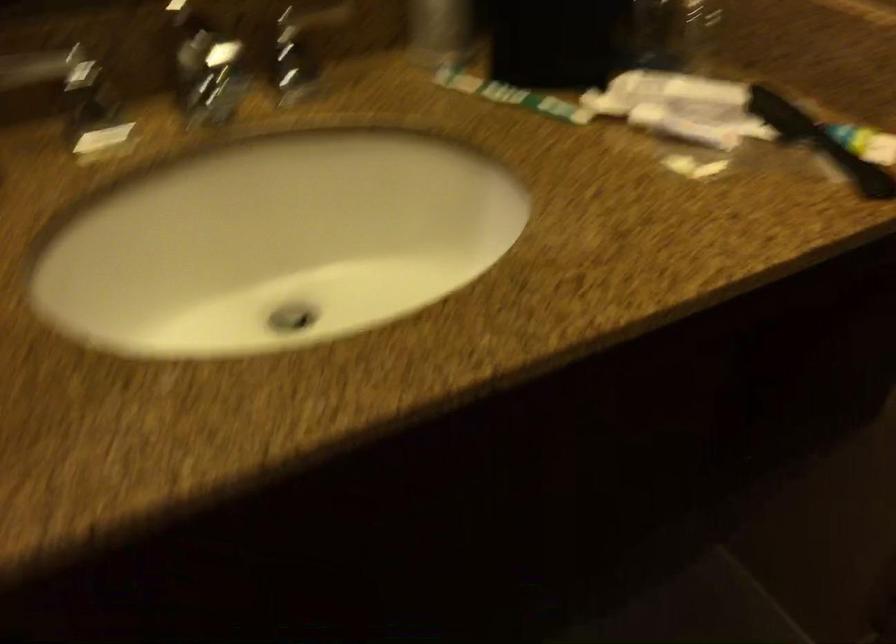
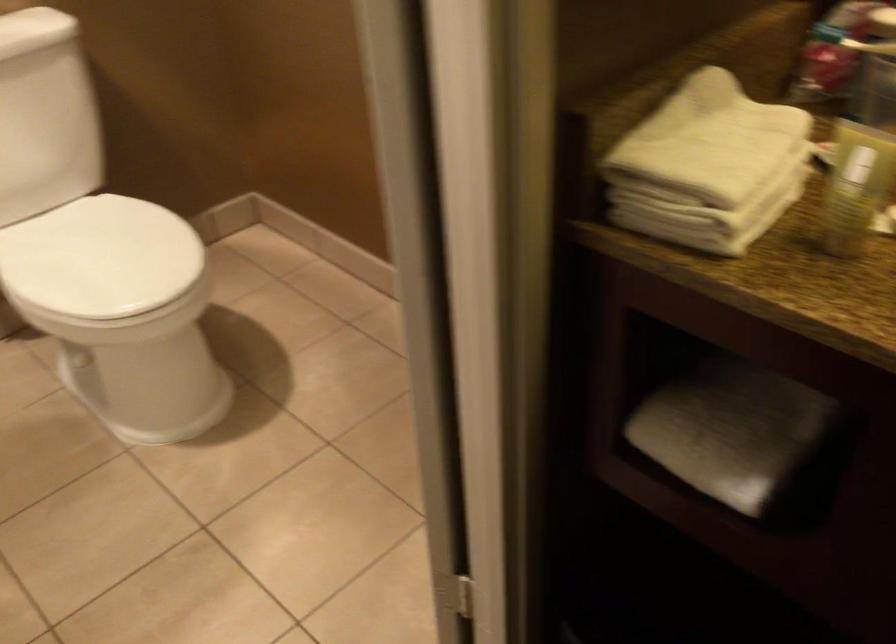
The first image is from the beginning of the video and the second image is from the end. How did the camera likely rotate when shooting the video?

The camera rotated toward left-down.